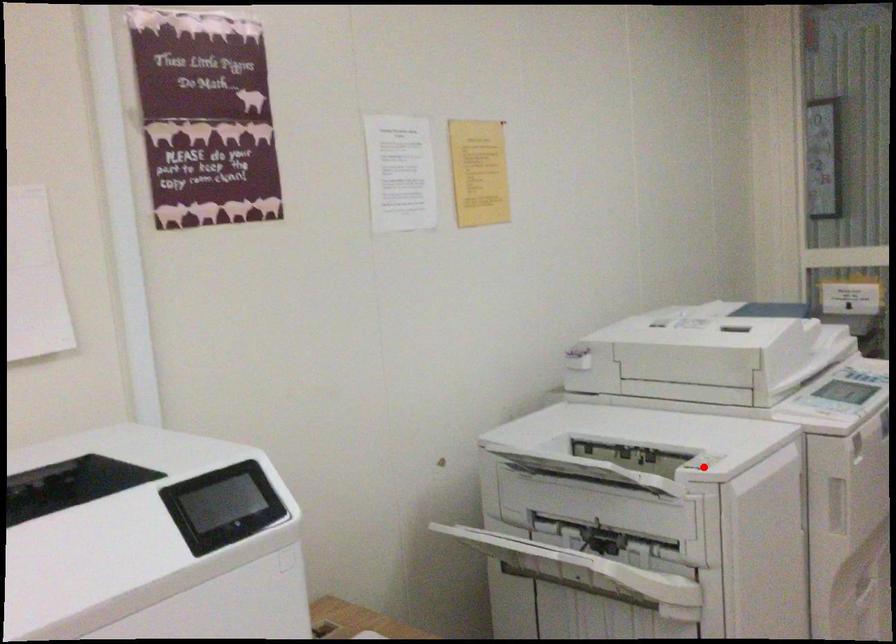
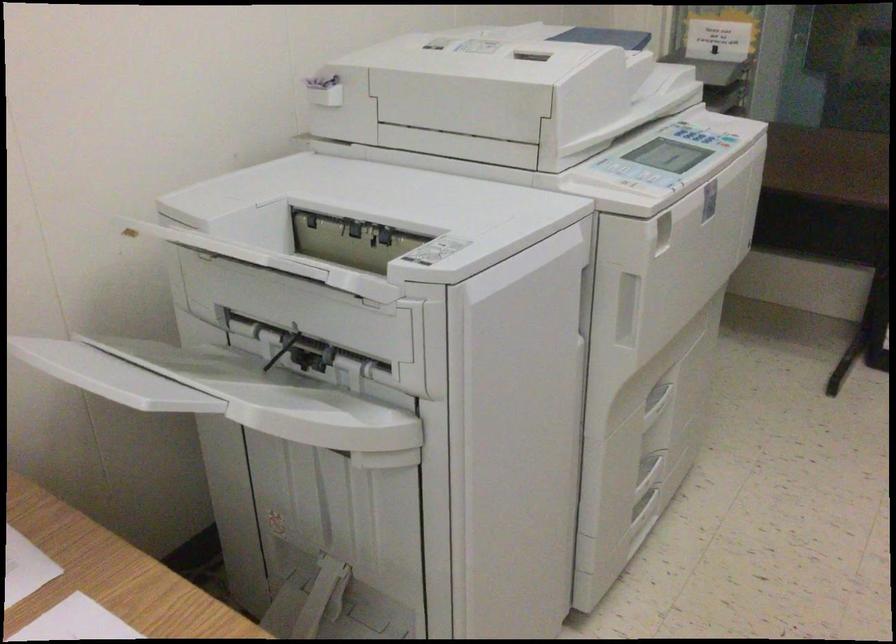
Question: I am providing you with two images of the same scene from different viewpoints. A red point is shown in image1. For the corresponding object point in image2, is it positioned nearer or farther from the camera?

Choices:
 (A) Nearer
 (B) Farther

Answer: (A)